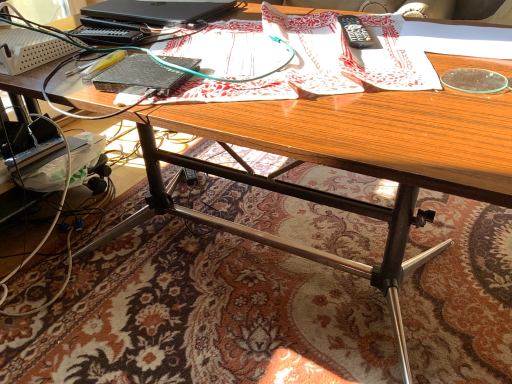
You are a GUI agent. You are given a task and a screenshot of the screen. Output one action in this format:
    pyautogui.click(x=<x>, y=<y>)
    Task: Click on the free space in front of black plastic remote control at upper right
    The image size is (512, 384).
    Given the screenshot: What is the action you would take?
    pyautogui.click(x=365, y=64)